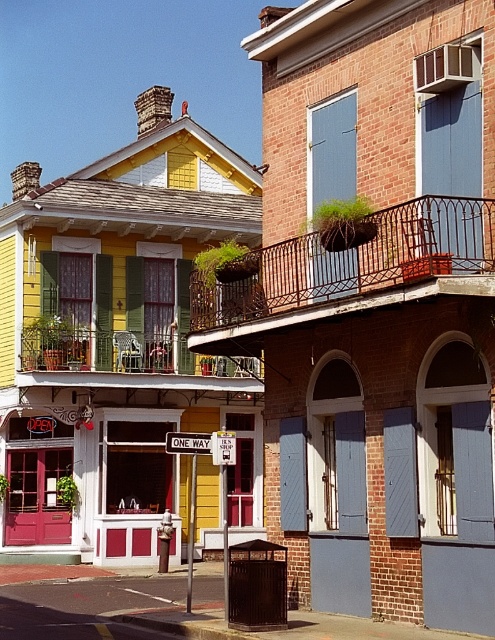
Is green wrought iron balcony at center above blue painted wood at center?

Actually, green wrought iron balcony at center is below blue painted wood at center.

Who is more distant from viewer, (42, 342) or (346, 186)?

Positioned behind is point (42, 342).

What do you see at coordinates (126, 362) in the screenshot? I see `green wrought iron balcony at center` at bounding box center [126, 362].

Image resolution: width=495 pixels, height=640 pixels. Identify the location of green wrought iron balcony at center. (126, 362).

Which of these two, gray wood shutter at center or brick balcony at upper right, stands taller?

gray wood shutter at center

Is point (411, 420) more distant than point (451, 86)?

Yes, point (411, 420) is behind point (451, 86).

Is point (386, 412) closer to camera compared to point (433, 90)?

No, (386, 412) is further to viewer.

Locate an element on the screen. gray wood shutter at center is located at coordinates 399,472.

Which of these two, rustic wrought iron balcony at upper center or blue painted wood at center, stands shorter?

Standing shorter between the two is rustic wrought iron balcony at upper center.

Between point (258, 266) and point (325, 134), which one is positioned in front?

Point (325, 134)

You are a GUI agent. You are given a task and a screenshot of the screen. Output one action in this format:
    pyautogui.click(x=<x>, y=<y>)
    Task: Click on the rustic wrought iron balcony at upper center
    The height and width of the screenshot is (640, 495).
    Given the screenshot: What is the action you would take?
    pyautogui.click(x=348, y=273)